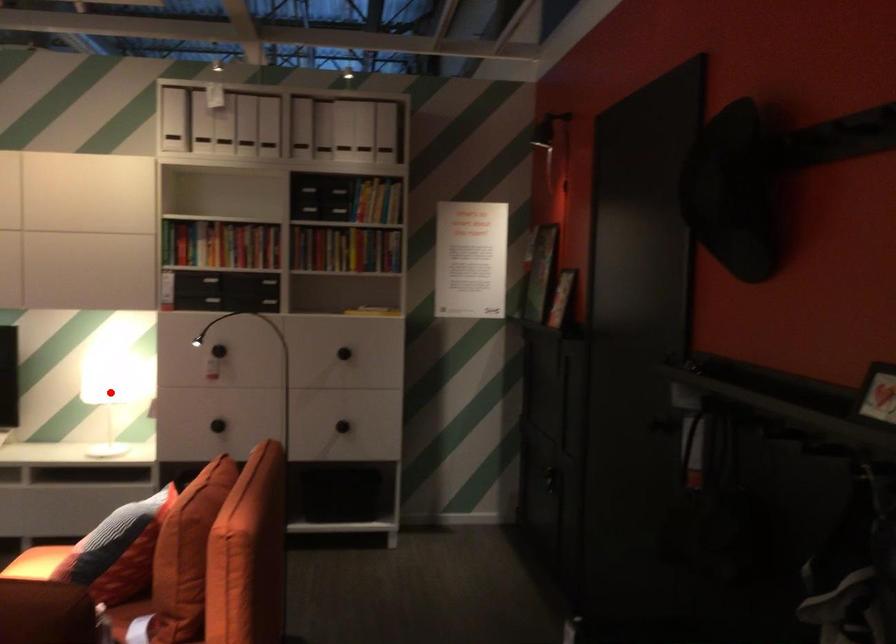
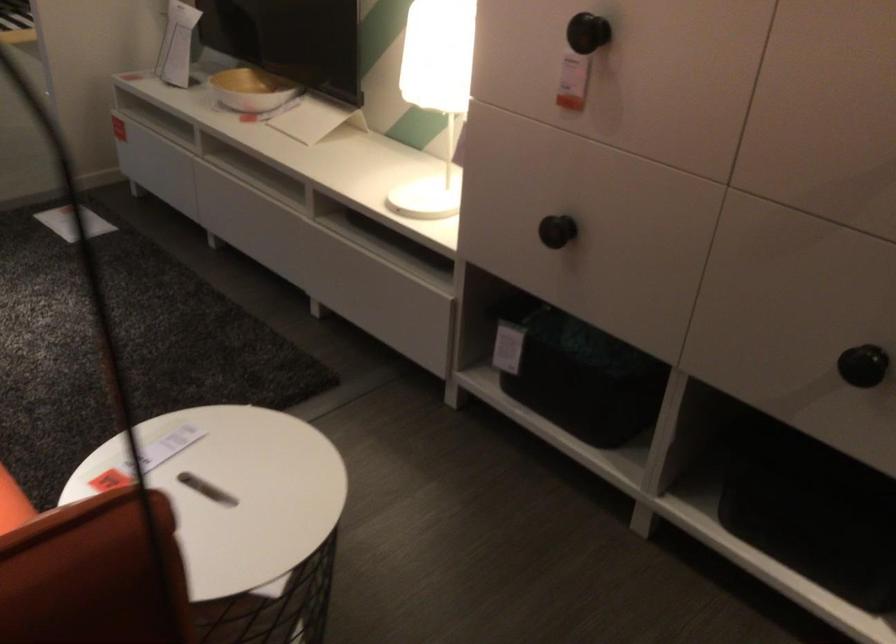
Question: I am providing you with two images of the same scene from different viewpoints. Given a red point in image1, look at the same physical point in image2. Is it:

Choices:
 (A) Closer to the viewpoint
 (B) Farther from the viewpoint

Answer: (A)